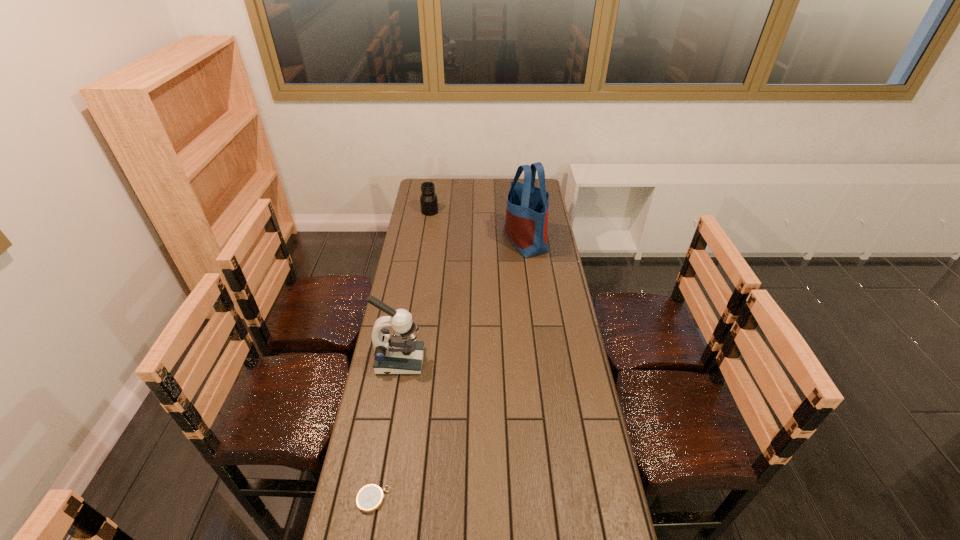
Locate an element on the screen. the tallest object is located at coordinates (526, 225).

Find the location of a particular element. The width and height of the screenshot is (960, 540). the third nearest object is located at coordinates (526, 225).

You are a GUI agent. You are given a task and a screenshot of the screen. Output one action in this format:
    pyautogui.click(x=<x>, y=<y>)
    Task: Click on the microscope
    
    Given the screenshot: What is the action you would take?
    pyautogui.click(x=401, y=354)

You are a GUI agent. You are given a task and a screenshot of the screen. Output one action in this format:
    pyautogui.click(x=<x>, y=<y>)
    Task: Click on the third farthest object
    
    Given the screenshot: What is the action you would take?
    pyautogui.click(x=401, y=354)

Where is `the farthest object`? the farthest object is located at coordinates (428, 200).

You are a GUI agent. You are given a task and a screenshot of the screen. Output one action in this format:
    pyautogui.click(x=<x>, y=<y>)
    Task: Click on the jar
    
    Given the screenshot: What is the action you would take?
    pyautogui.click(x=428, y=200)

Locate an element on the screen. the shortest object is located at coordinates pos(370,497).

Locate an element on the screen. The image size is (960, 540). the nearest object is located at coordinates (370, 497).

In order to click on free space located on the back of the handbag in this screenshot , I will do `click(520, 204)`.

You are a GUI agent. You are given a task and a screenshot of the screen. Output one action in this format:
    pyautogui.click(x=<x>, y=<y>)
    Task: Click on the free space located at the eyepiece of the second nearest object
    
    Given the screenshot: What is the action you would take?
    pyautogui.click(x=448, y=361)